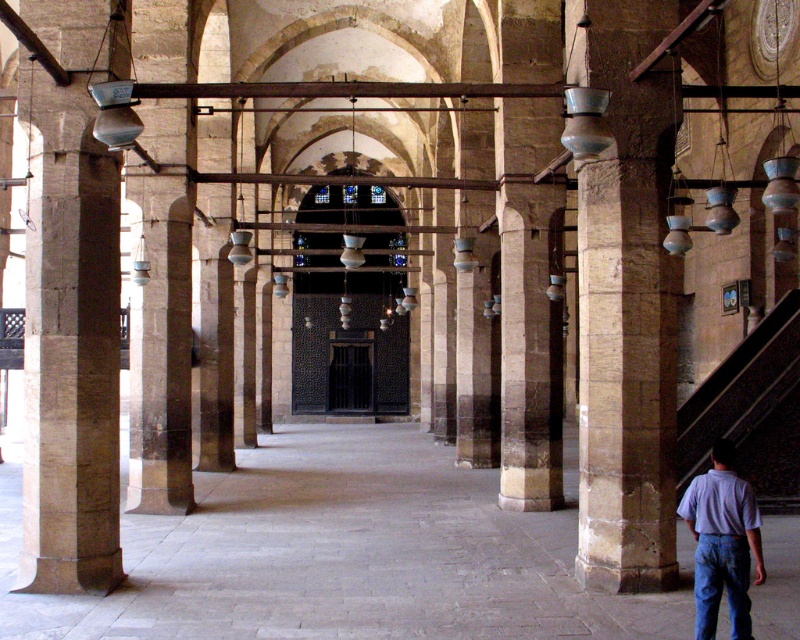
You are standing in the grand mosque and want to move from the point at coordinates point (714, 372) to the point at coordinates point (713, 580). Since both points are on the floor, which direction should you walk to reach the second point?

You should walk towards the right because point (714, 372) is closer to you than point (713, 580), meaning the second point is further away in the same direction.